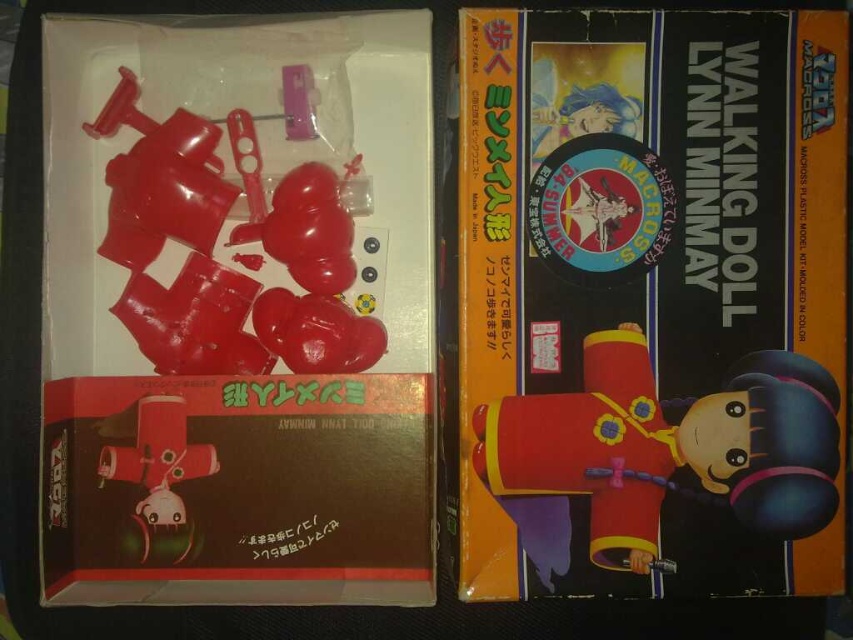
Is matte red plastic walking doll at lower left positioned in front of matte red plastic at center?

Yes, matte red plastic walking doll at lower left is in front of matte red plastic at center.

Between matte red plastic walking doll at lower left and matte red plastic at center, which one is positioned higher?

matte red plastic at center is above.

Is point (190, 445) positioned behind point (315, 246)?

That is False.

At what (x,y) coordinates should I click in order to perform the action: click on matte red plastic walking doll at lower left. Please return your answer as a coordinate pair (x, y). The width and height of the screenshot is (853, 640). Looking at the image, I should click on (158, 467).

Based on the photo, which is more to the left, matte plastic parts at center or matte plastic box at center?

From the viewer's perspective, matte plastic parts at center appears more on the left side.

Which is in front, point (335, 333) or point (595, 310)?

Point (595, 310)

The width and height of the screenshot is (853, 640). I want to click on matte plastic parts at center, so click(236, 310).

Can you confirm if matte plastic box at center is taller than matte red plastic walking doll at center?

Indeed, matte plastic box at center has a greater height compared to matte red plastic walking doll at center.

Between matte plastic box at center and matte red plastic walking doll at center, which one appears on the right side from the viewer's perspective?

From the viewer's perspective, matte plastic box at center appears more on the right side.

Between point (694, 35) and point (635, 420), which one is positioned in front?

Positioned in front is point (694, 35).

Image resolution: width=853 pixels, height=640 pixels. In order to click on matte plastic box at center in this screenshot , I will do `click(651, 301)`.